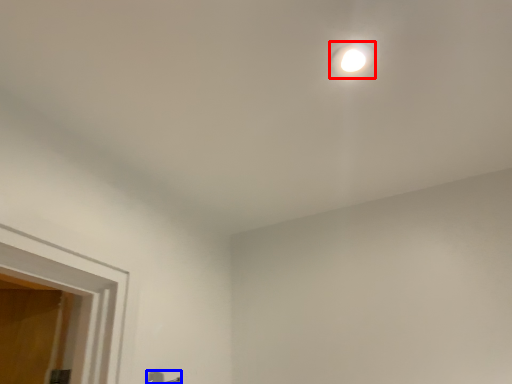
Question: Which of the following is the closest to the observer, droplight (highlighted by a red box) or door handle (highlighted by a blue box)?

Choices:
 (A) droplight
 (B) door handle

Answer: (A)